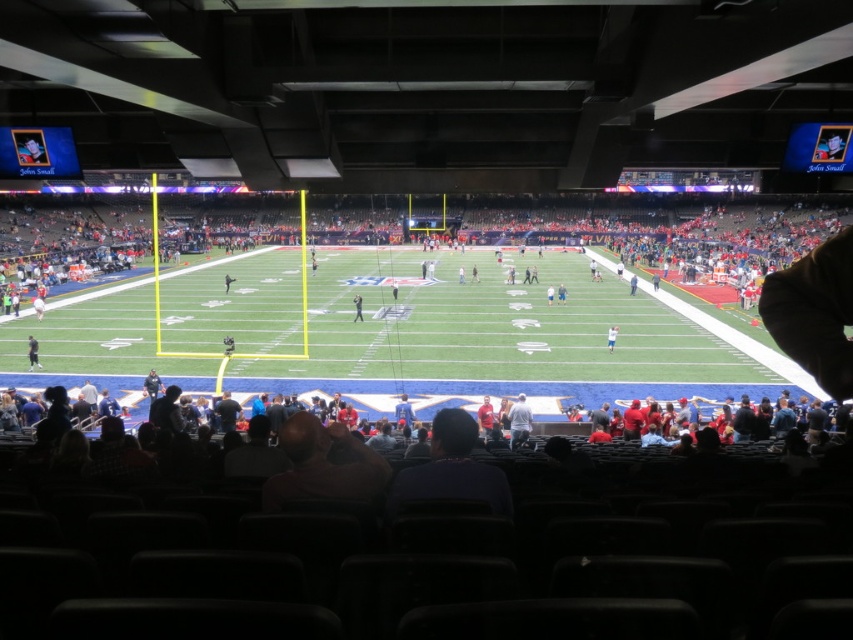
Can you confirm if light brown leather jacket at lower left is smaller than dark blue jersey at center?

Correct, light brown leather jacket at lower left occupies less space than dark blue jersey at center.

Who is taller, light brown leather jacket at lower left or dark blue jersey at center?

With more height is dark blue jersey at center.

This screenshot has height=640, width=853. Identify the location of light brown leather jacket at lower left. (32, 353).

Which is more to the left, dark blue shirt at center or dark blue uniform at center?

From the viewer's perspective, dark blue uniform at center appears more on the left side.

Is point (428, 461) positioned behind point (361, 308)?

No, (428, 461) is closer to viewer.

Locate an element on the screen. dark blue shirt at center is located at coordinates (451, 468).

Can you confirm if dark blue uniform at center is wider than white cotton shirt at center?

Indeed, dark blue uniform at center has a greater width compared to white cotton shirt at center.

Does dark blue uniform at center have a larger size compared to white cotton shirt at center?

Yes.

Is point (354, 298) closer to viewer compared to point (618, 326)?

No, (354, 298) is behind (618, 326).

This screenshot has width=853, height=640. What are the coordinates of `dark blue uniform at center` in the screenshot? It's located at [x=357, y=307].